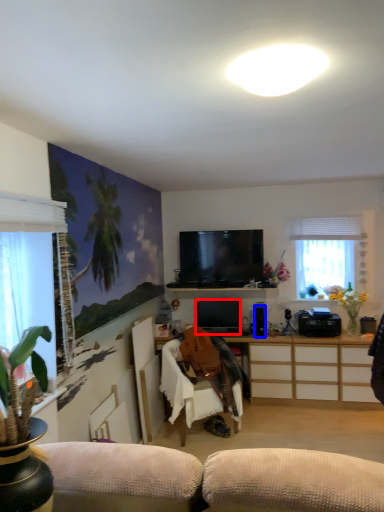
Question: Which object is further to the camera taking this photo, television (highlighted by a red box) or speaker (highlighted by a blue box)?

Choices:
 (A) television
 (B) speaker

Answer: (A)